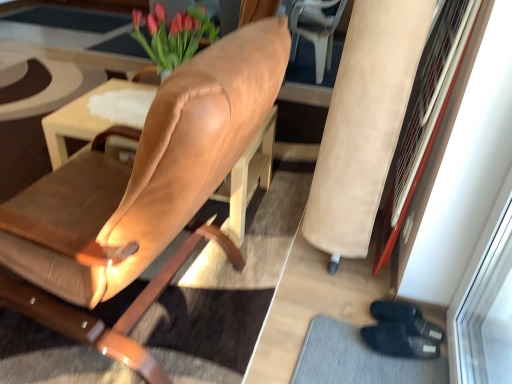
This screenshot has width=512, height=384. What are the coordinates of `vacant area on the back side of black fabric doormat at lower right` in the screenshot? It's located at (336, 286).